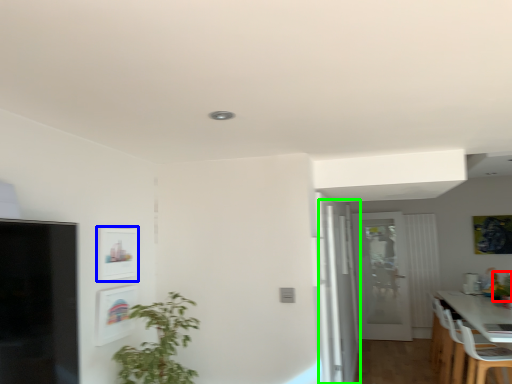
Question: Considering the real-world distances, which object is farthest from plant (highlighted by a red box)? picture frame (highlighted by a blue box) or glass door (highlighted by a green box)?

Choices:
 (A) picture frame
 (B) glass door

Answer: (A)